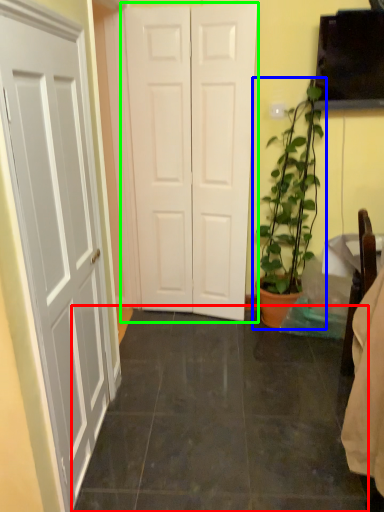
Question: Based on their relative distances, which object is nearer to tile (highlighted by a red box)? Choose from houseplant (highlighted by a blue box) and door (highlighted by a green box).

Choices:
 (A) houseplant
 (B) door

Answer: (A)